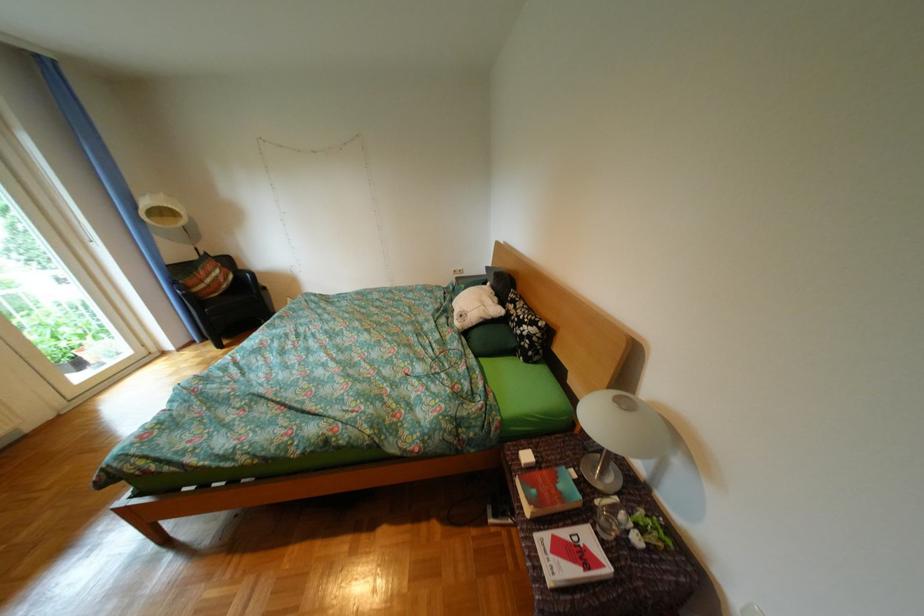
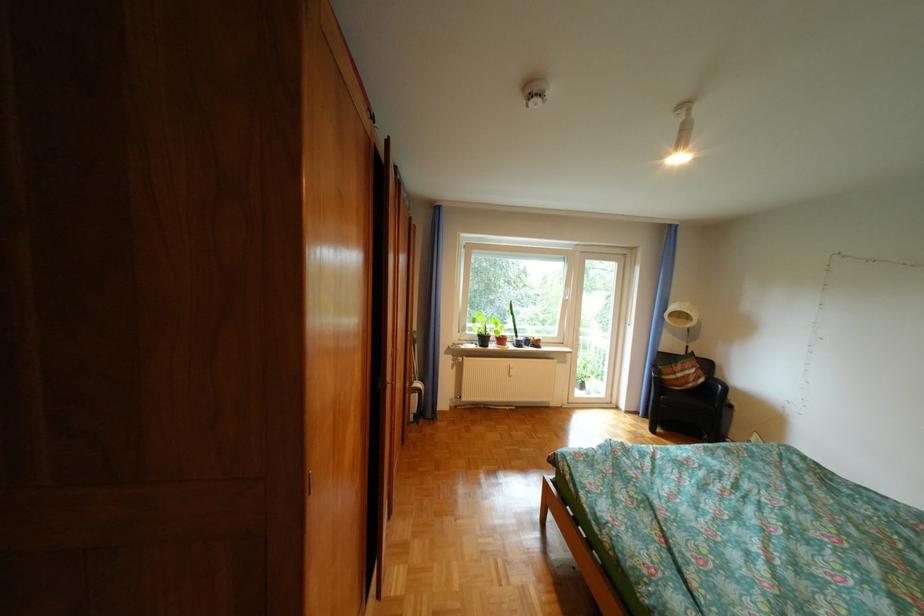
Question: Based on the continuous images, in which direction is the camera rotating? Reply with the corresponding letter.

Choices:
 (A) Left
 (B) Right
 (C) Up
 (D) Down

Answer: (A)